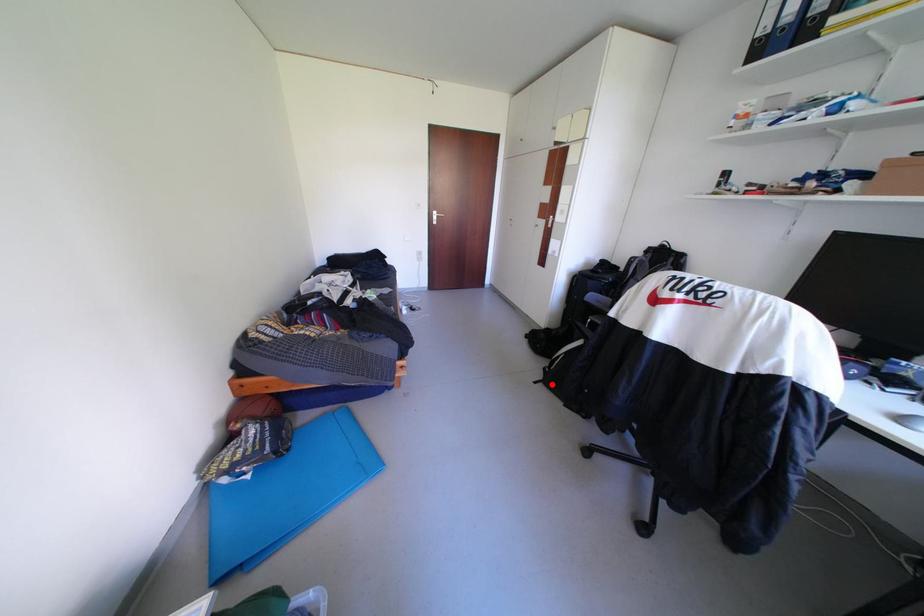
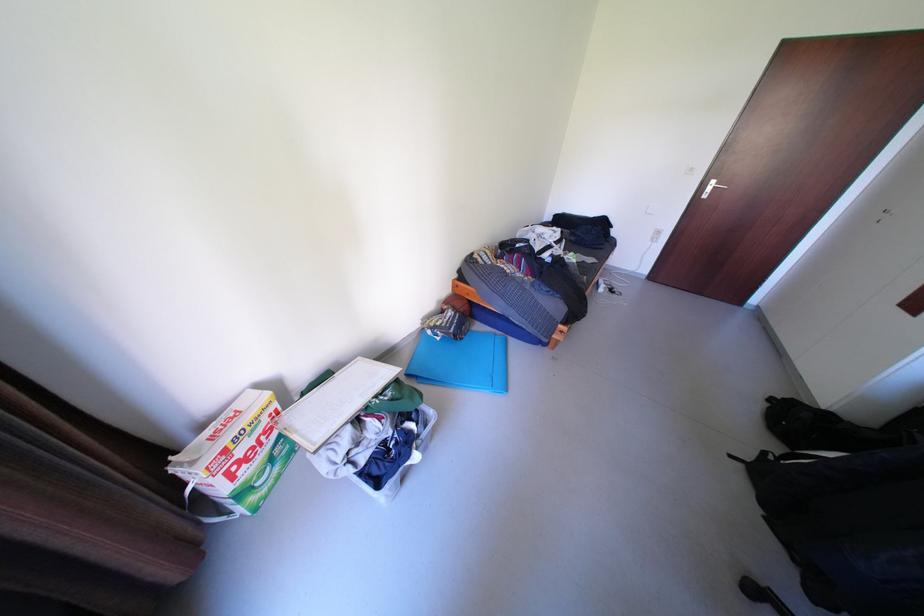
The point at the highlighted location is marked in the first image. Where is the corresponding point in the second image?

(752, 466)